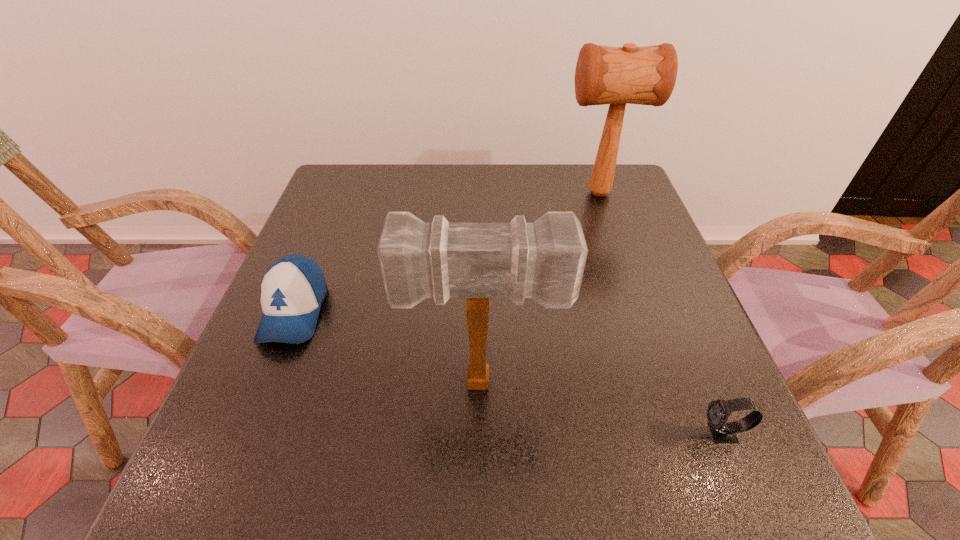
This screenshot has height=540, width=960. I want to click on the right mallet, so click(x=646, y=75).

I want to click on the farther mallet, so click(646, 75).

This screenshot has width=960, height=540. Find the location of `the left mallet`. the left mallet is located at coordinates (544, 260).

Where is `the second nearest object`? The image size is (960, 540). the second nearest object is located at coordinates (544, 260).

You are a GUI agent. You are given a task and a screenshot of the screen. Output one action in this format:
    pyautogui.click(x=<x>, y=<y>)
    Task: Click on the third nearest object
    The height and width of the screenshot is (540, 960).
    Given the screenshot: What is the action you would take?
    pyautogui.click(x=292, y=290)

The height and width of the screenshot is (540, 960). I want to click on baseball cap, so (292, 290).

Locate an element on the screen. the nearest object is located at coordinates (718, 411).

This screenshot has width=960, height=540. What are the coordinates of `free location located 0.050m on the strike surface of the farthest object` in the screenshot? It's located at (541, 193).

I want to click on vacant space located 0.180m on the strike surface of the farthest object, so click(495, 193).

Locate an element on the screen. vacant space located 0.100m on the strike surface of the farthest object is located at coordinates (523, 193).